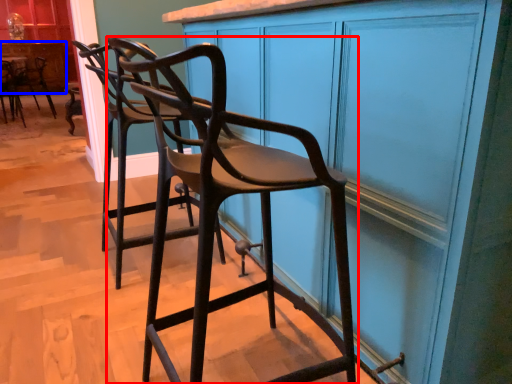
Question: Which object is closer to the camera taking this photo, chair (highlighted by a red box) or cabinetry (highlighted by a blue box)?

Choices:
 (A) chair
 (B) cabinetry

Answer: (A)